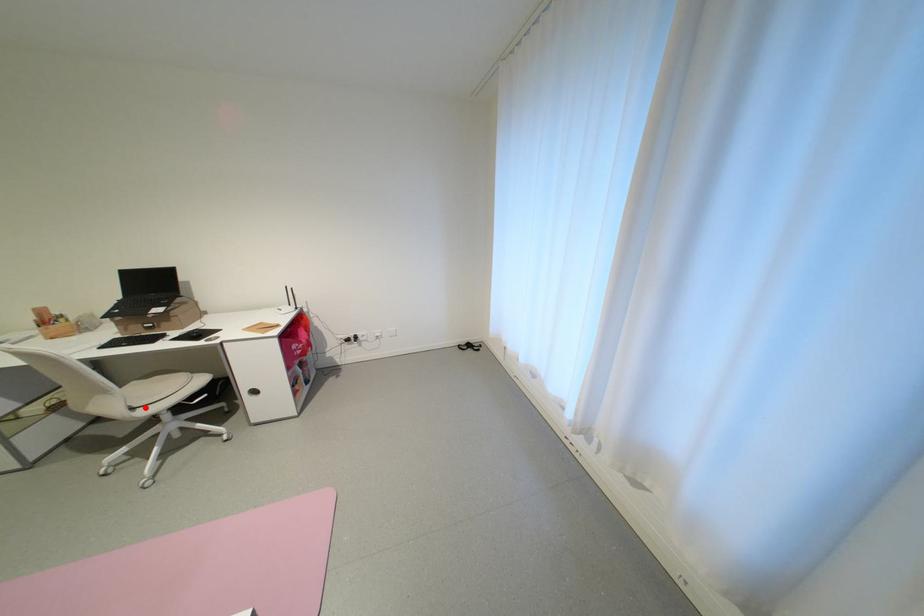
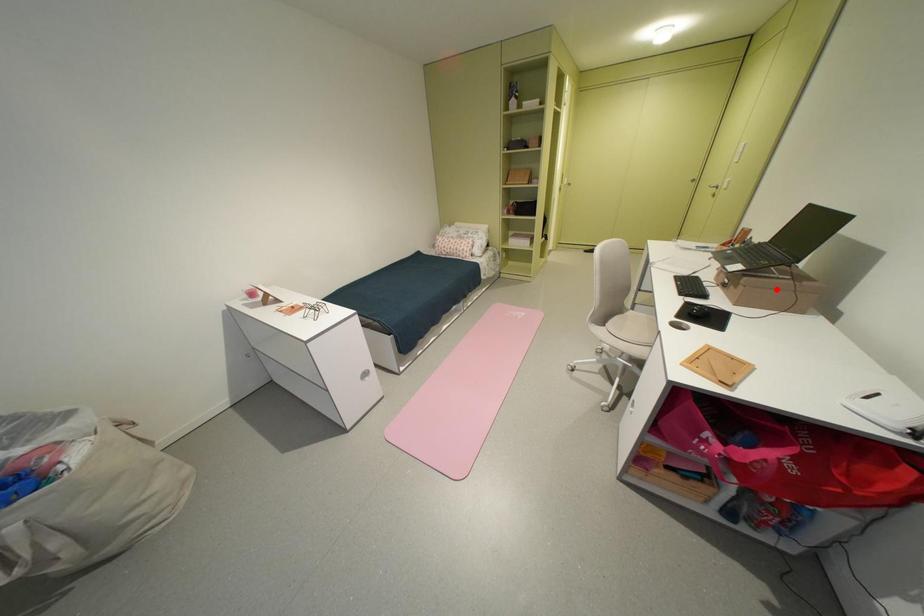
I am providing you with two images of the same scene from different viewpoints. A red point is marked on the first image and another point is marked on the second image. Does the point marked in image1 correspond to the same location as the one in image2?

No